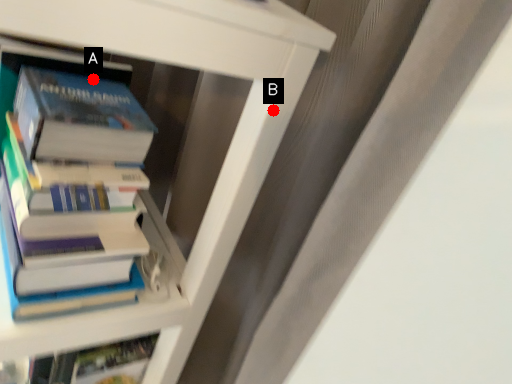
Question: Two points are circled on the image, labeled by A and B beside each circle. Which point is farther from the camera taking this photo?

Choices:
 (A) A is further
 (B) B is further

Answer: (A)